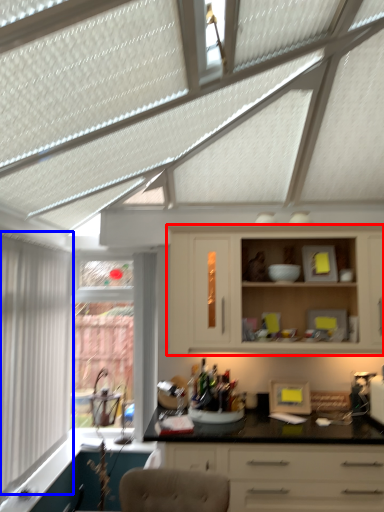
Question: Which object appears closest to the camera in this image, cabinetry (highlighted by a red box) or window (highlighted by a blue box)?

Choices:
 (A) cabinetry
 (B) window

Answer: (B)